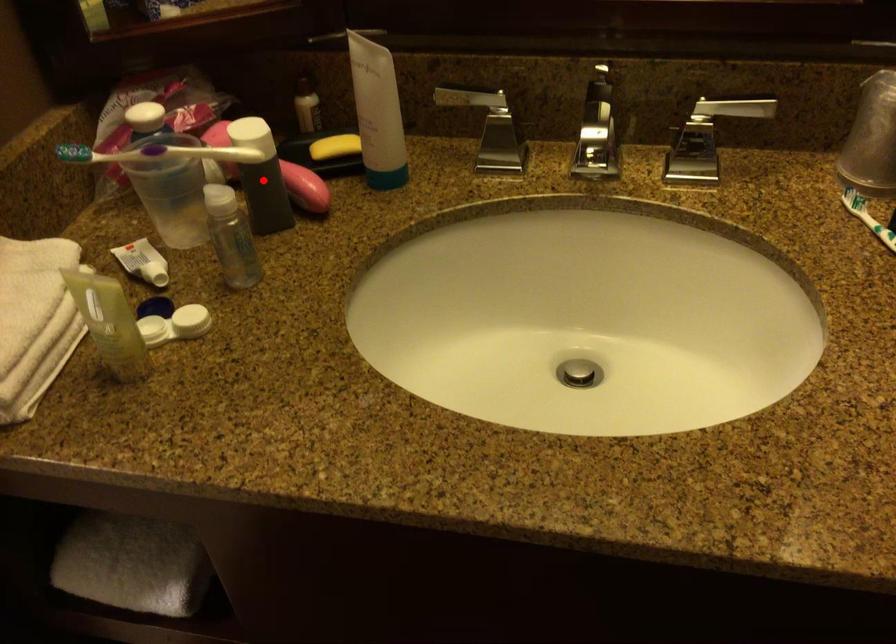
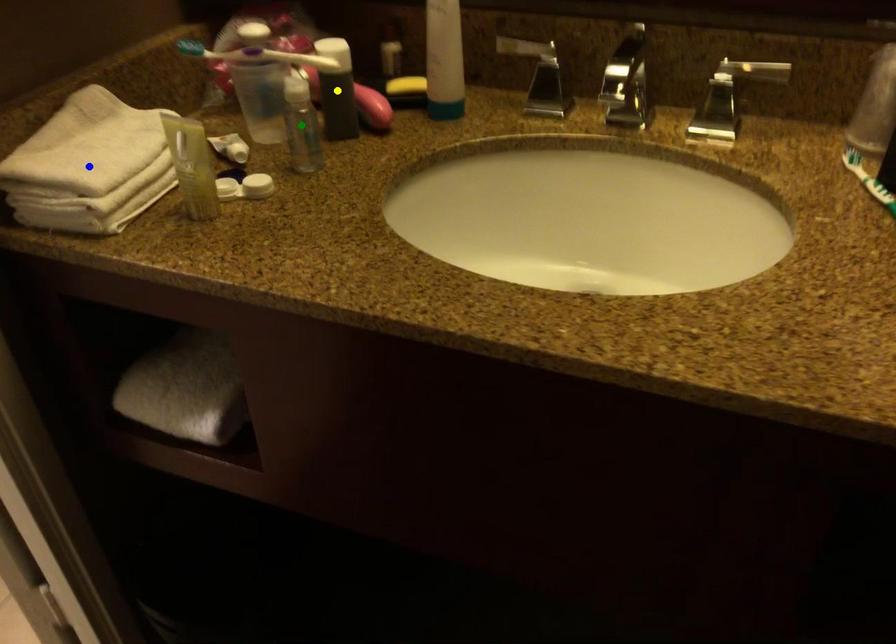
Question: I am providing you with two images of the same scene from different viewpoints. A red point is marked on the first image. You are given multiple points on the second image. Can you choose the point in image 2 that corresponds to the point in image 1?

Choices:
 (A) yellow point
 (B) green point
 (C) blue point

Answer: (A)